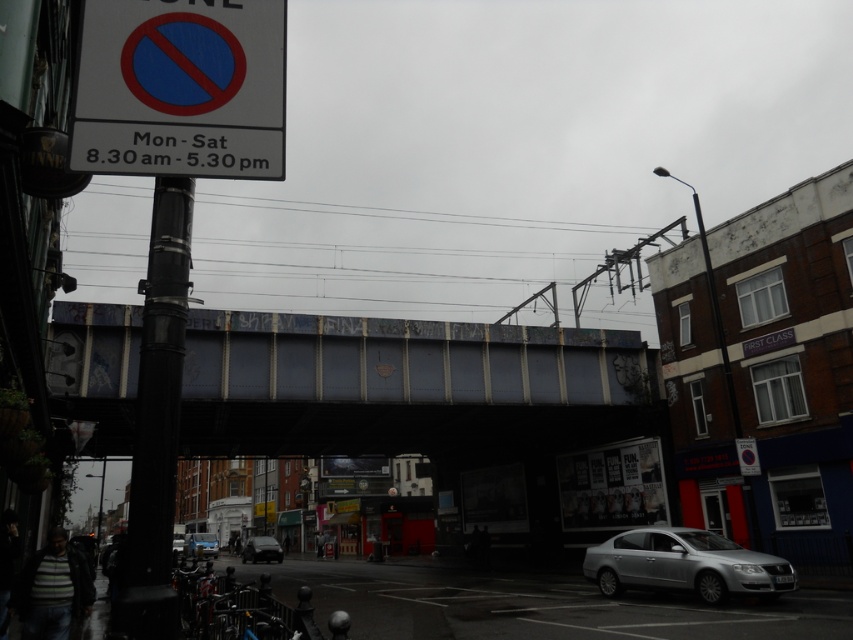
Question: Which point is farther from the camera taking this photo?

Choices:
 (A) (706, 564)
 (B) (222, 28)

Answer: (A)

Question: Is black metal pole at left closer to the viewer compared to silver metallic car at center?

Choices:
 (A) no
 (B) yes

Answer: (B)

Question: Estimate the real-world distances between objects in this image. Which object is closer to the rusty metal bridge at center?

Choices:
 (A) silver metallic car at center
 (B) silver metallic sedan at lower right
 (C) metallic silver car at lower center

Answer: (A)

Question: Can you confirm if white plastic sign at upper left is positioned below black metal pole at left?

Choices:
 (A) no
 (B) yes

Answer: (A)

Question: Is black metal pole at left to the left of matte black car at center from the viewer's perspective?

Choices:
 (A) yes
 (B) no

Answer: (B)

Question: Based on their relative distances, which object is farther from the silver metallic car at center?

Choices:
 (A) matte black car at center
 (B) metallic silver car at lower center

Answer: (A)